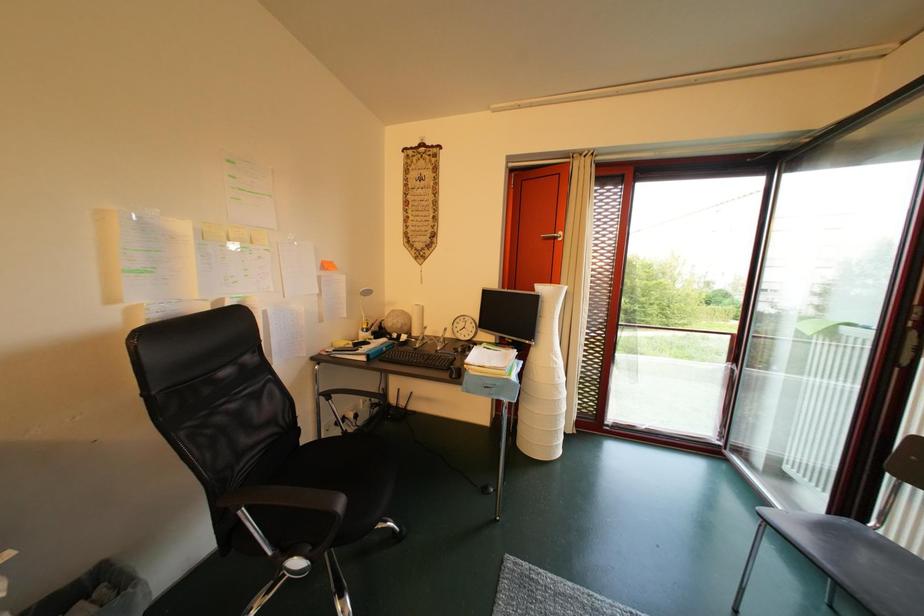
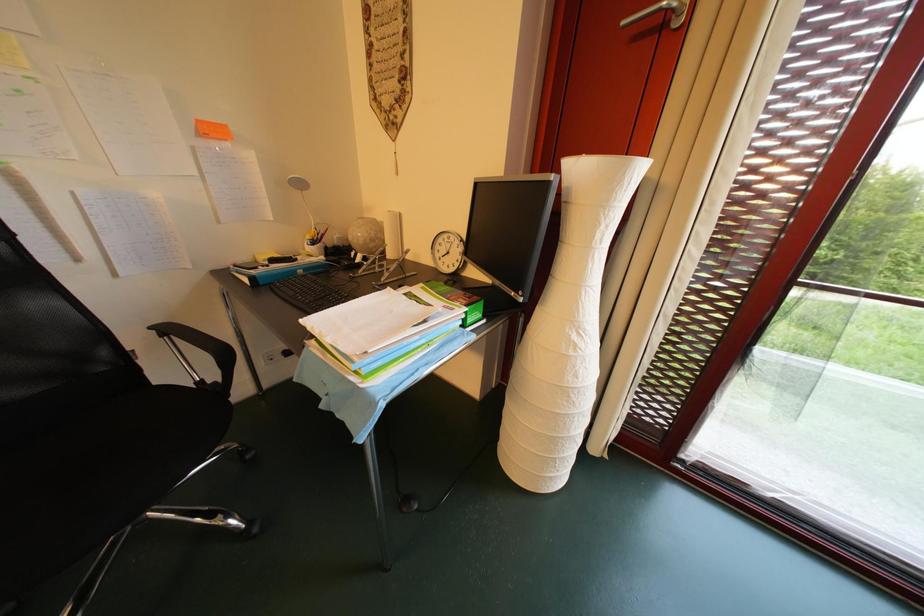
The images are taken continuously from a first-person perspective. In which direction are you moving?

The cameraman moved toward right, forward.